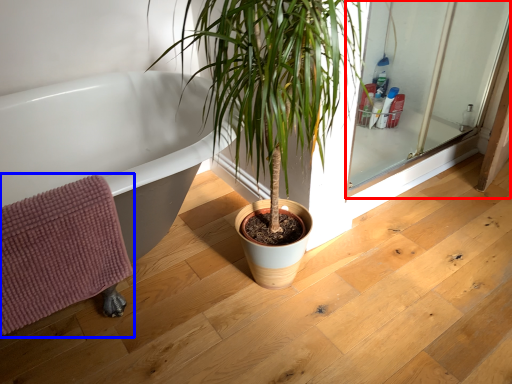
Question: Which of the following is the farthest to the observer, screen door (highlighted by a red box) or bath towel (highlighted by a blue box)?

Choices:
 (A) screen door
 (B) bath towel

Answer: (A)